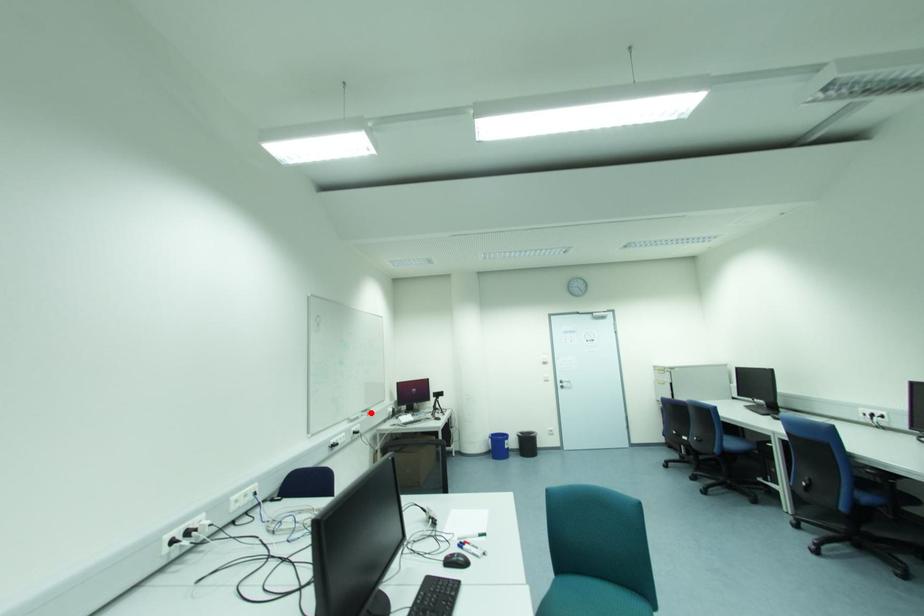
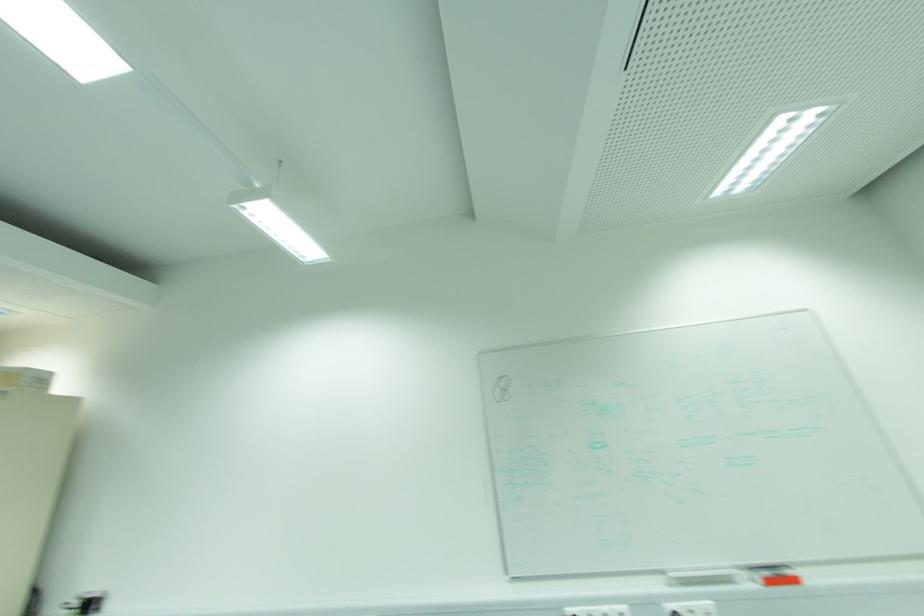
In the second image, find the point that corresponds to the highlighted location in the first image.

(796, 581)